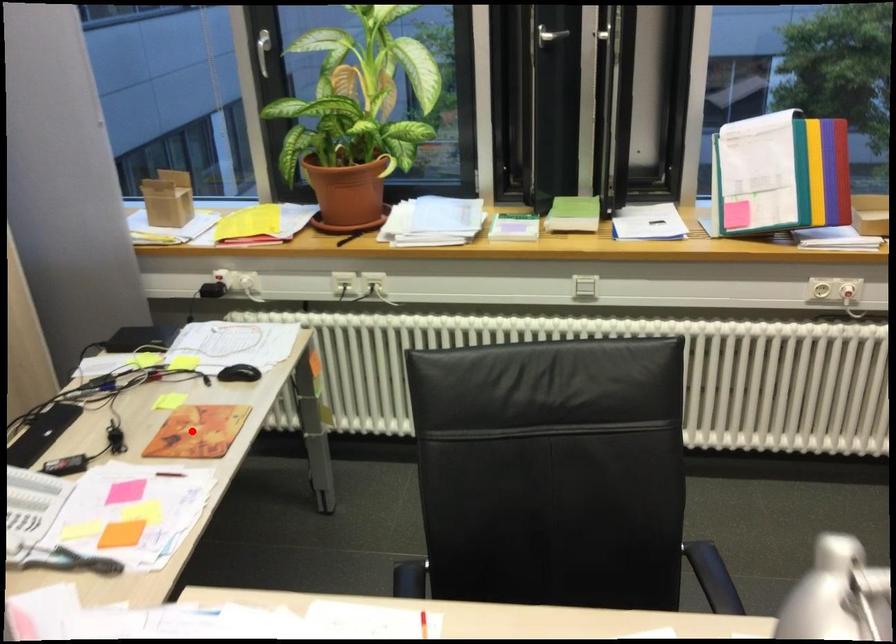
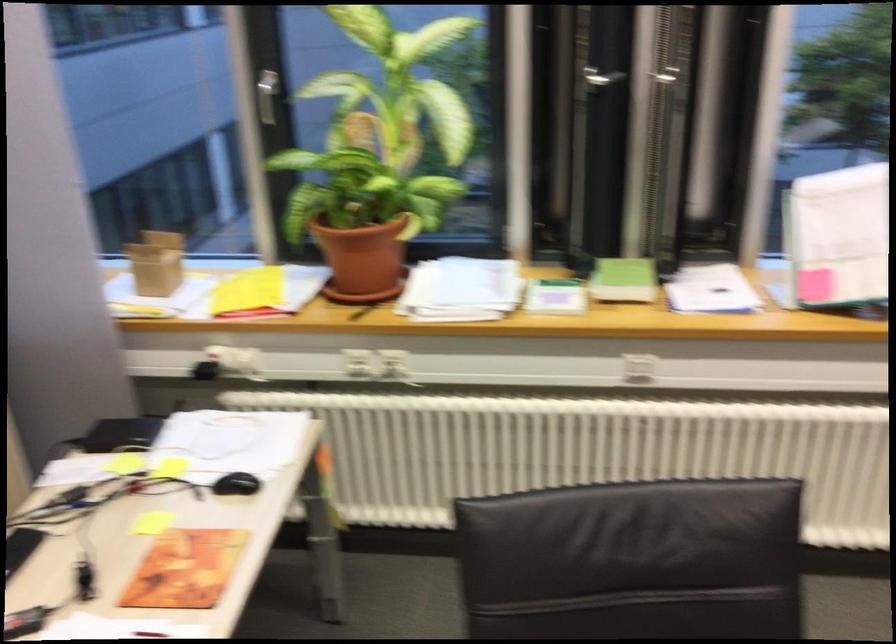
In the second image, find the point that corresponds to the highlighted location in the first image.

(185, 569)